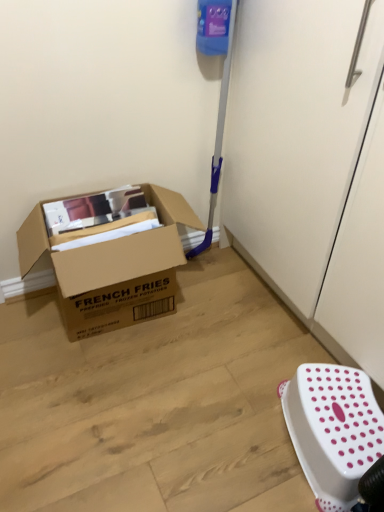
Question: Should I look upward or downward to see brown cardboard box at left?

Choices:
 (A) down
 (B) up

Answer: (A)

Question: From a real-world perspective, does white plastic stool at lower right stand above brown cardboard box at left?

Choices:
 (A) yes
 (B) no

Answer: (B)

Question: From the image's perspective, does white plastic stool at lower right appear lower than brown cardboard box at left?

Choices:
 (A) no
 (B) yes

Answer: (B)

Question: Considering the relative sizes of white plastic stool at lower right and brown cardboard box at left in the image provided, is white plastic stool at lower right bigger than brown cardboard box at left?

Choices:
 (A) no
 (B) yes

Answer: (A)

Question: Is white plastic stool at lower right taller than brown cardboard box at left?

Choices:
 (A) yes
 (B) no

Answer: (B)

Question: Is white plastic stool at lower right touching brown cardboard box at left?

Choices:
 (A) yes
 (B) no

Answer: (B)

Question: Does white plastic stool at lower right have a greater width compared to brown cardboard box at left?

Choices:
 (A) yes
 (B) no

Answer: (B)

Question: Is brown cardboard box at left positioned far away from white plastic stool at lower right?

Choices:
 (A) no
 (B) yes

Answer: (A)

Question: Is brown cardboard box at left at the left side of white plastic stool at lower right?

Choices:
 (A) no
 (B) yes

Answer: (B)

Question: From the image's perspective, is brown cardboard box at left below white plastic stool at lower right?

Choices:
 (A) yes
 (B) no

Answer: (B)

Question: Can you confirm if brown cardboard box at left is smaller than white plastic stool at lower right?

Choices:
 (A) no
 (B) yes

Answer: (A)

Question: Can you confirm if brown cardboard box at left is positioned to the right of white plastic stool at lower right?

Choices:
 (A) yes
 (B) no

Answer: (B)

Question: Considering the relative sizes of brown cardboard box at left and white plastic stool at lower right in the image provided, is brown cardboard box at left taller than white plastic stool at lower right?

Choices:
 (A) yes
 (B) no

Answer: (A)

Question: Considering the positions of white plastic stool at lower right and brown cardboard box at left in the image, is white plastic stool at lower right wider or thinner than brown cardboard box at left?

Choices:
 (A) thin
 (B) wide

Answer: (A)